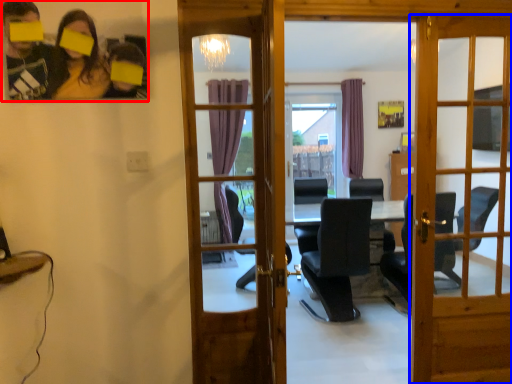
Question: Among these objects, which one is nearest to the camera, couple (highlighted by a red box) or door (highlighted by a blue box)?

Choices:
 (A) couple
 (B) door

Answer: (A)